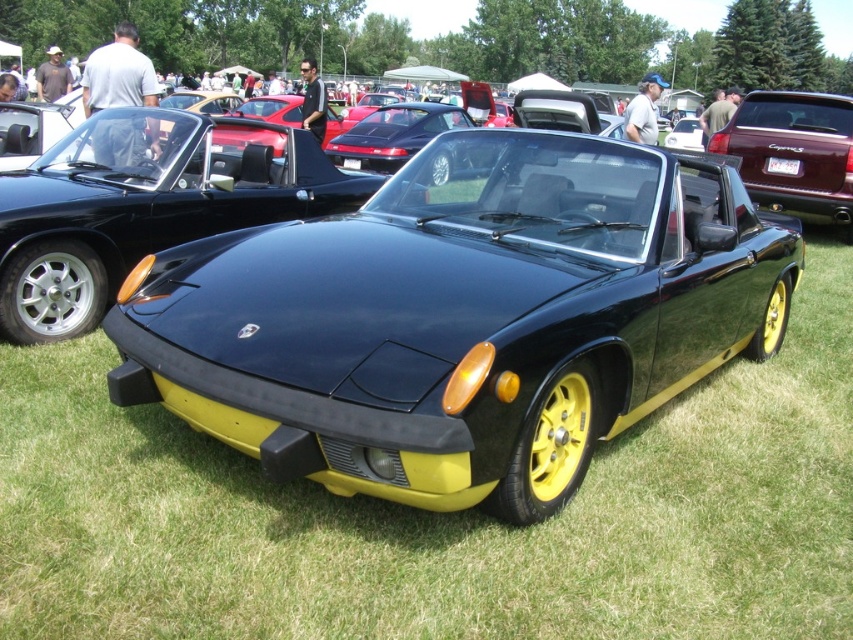
Question: Does shiny black convertible at center appear on the left side of matte black convertible at upper right?

Choices:
 (A) yes
 (B) no

Answer: (A)

Question: Does shiny black convertible at center lie behind matte black convertible at upper right?

Choices:
 (A) yes
 (B) no

Answer: (B)

Question: Among these points, which one is nearest to the camera?

Choices:
 (A) (102, 289)
 (B) (851, 208)

Answer: (A)

Question: Is the position of shiny black convertible at center more distant than that of matte black convertible at upper right?

Choices:
 (A) no
 (B) yes

Answer: (A)

Question: Which object appears closest to the camera in this image?

Choices:
 (A) shiny black convertible at center
 (B) matte black convertible at upper right

Answer: (A)